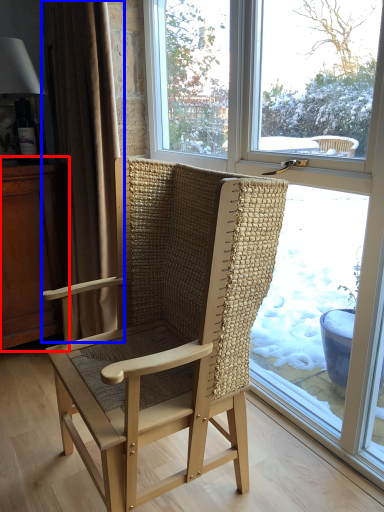
Question: Which point is further to the camera, dresser (highlighted by a red box) or curtain (highlighted by a blue box)?

Choices:
 (A) dresser
 (B) curtain

Answer: (A)